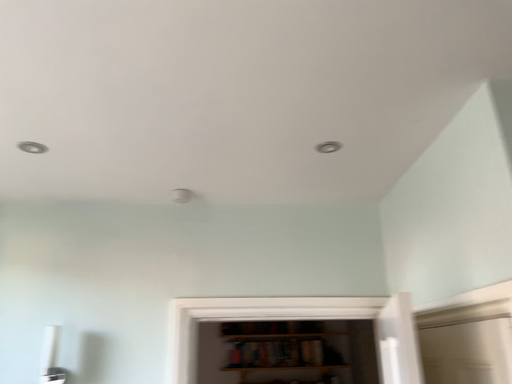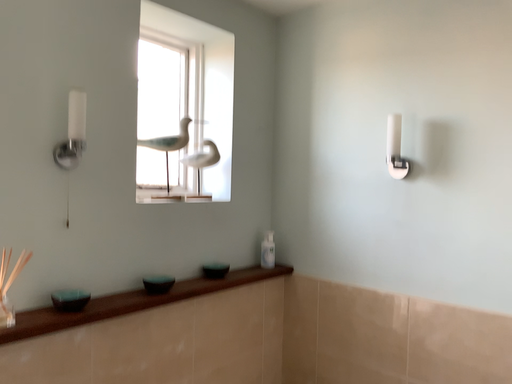
Question: Which way did the camera rotate in the video?

Choices:
 (A) rotated upward
 (B) rotated downward

Answer: (B)